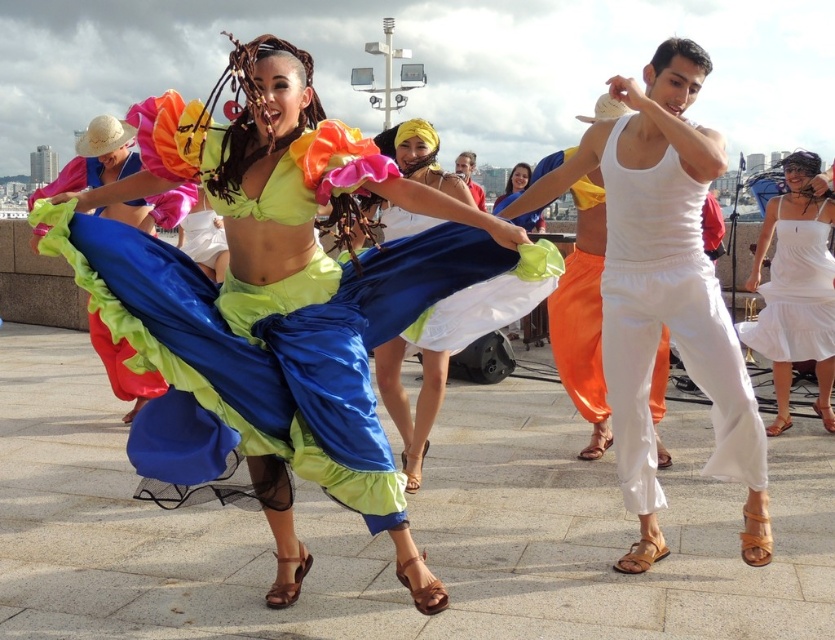
Question: Which of these objects is positioned farthest from the shiny satin skirt at center?

Choices:
 (A) white cotton tank top at center
 (B) matte white dress at center

Answer: (B)

Question: Does white cotton tank top at center appear under matte white dress at center?

Choices:
 (A) no
 (B) yes

Answer: (B)

Question: Is the position of shiny satin skirt at center more distant than that of white cotton dress at center?

Choices:
 (A) no
 (B) yes

Answer: (A)

Question: Among these points, which one is farthest from the camera?

Choices:
 (A) (428, 372)
 (B) (797, 216)
 (C) (519, 180)

Answer: (C)

Question: Estimate the real-world distances between objects in this image. Which object is closer to the white cotton dress at center?

Choices:
 (A) matte white dress at center
 (B) shiny satin skirt at center

Answer: (A)

Question: Is shiny satin skirt at center smaller than matte white dress at center?

Choices:
 (A) yes
 (B) no

Answer: (A)